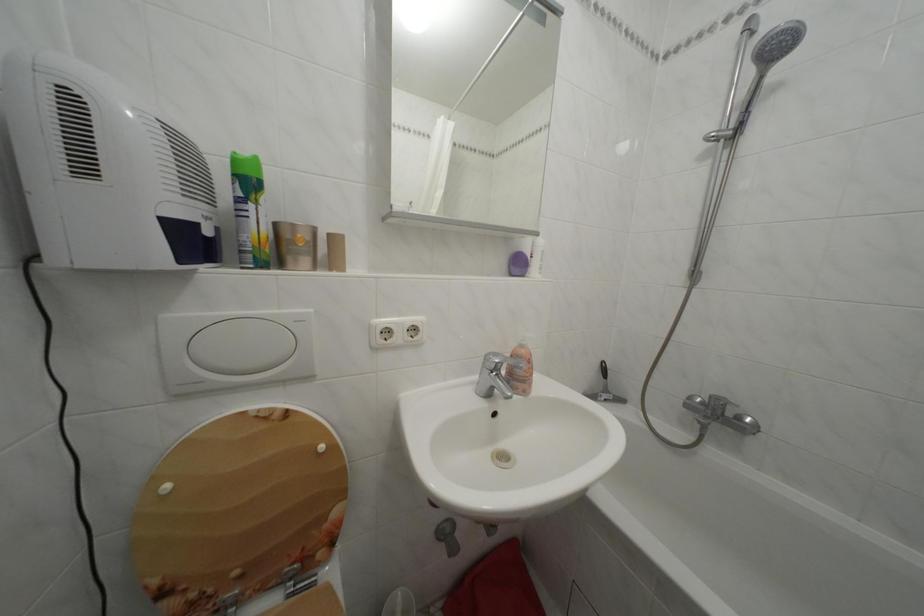
Locate an element on the screen. This screenshot has width=924, height=616. soap dispenser pump is located at coordinates (524, 345).